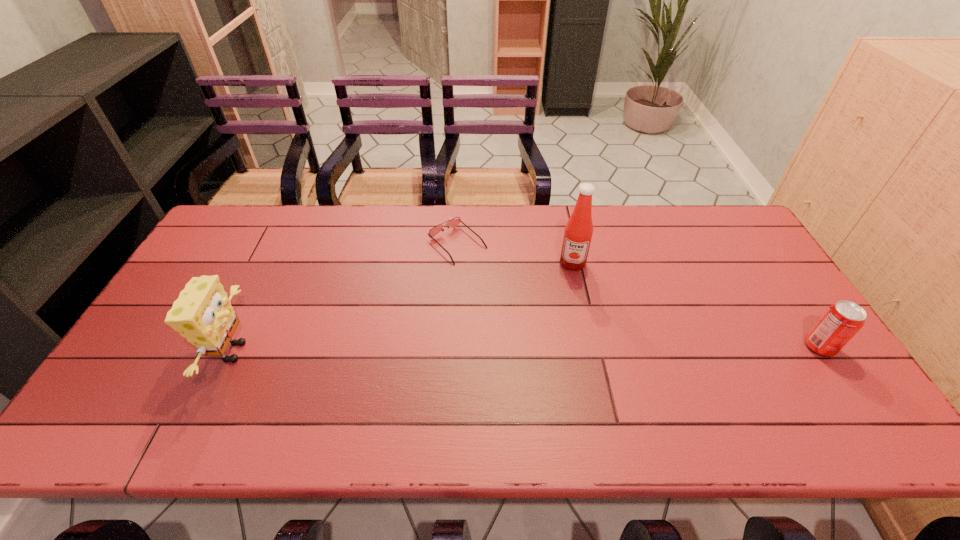
You are a GUI agent. You are given a task and a screenshot of the screen. Output one action in this format:
    pyautogui.click(x=<x>, y=<y>)
    Task: Click on the free location at the right edge
    
    Given the screenshot: What is the action you would take?
    pyautogui.click(x=735, y=260)

In the image, there is a desktop. Where is `vacant space at the far left corner`? vacant space at the far left corner is located at coordinates (232, 240).

Locate an element on the screen. Image resolution: width=960 pixels, height=540 pixels. free point at the far right corner is located at coordinates click(686, 217).

In the image, there is a desktop. Identify the location of vacant space at the near right corner. The image size is (960, 540). (794, 375).

Where is `empty space that is in between the sponge and the third tallest object`? The width and height of the screenshot is (960, 540). empty space that is in between the sponge and the third tallest object is located at coordinates (526, 349).

Image resolution: width=960 pixels, height=540 pixels. In order to click on vacant area between the third object from left to right and the leftmost object in this screenshot , I will do `click(403, 308)`.

Where is `vacant space in between the rightmost object and the tallest object`? The width and height of the screenshot is (960, 540). vacant space in between the rightmost object and the tallest object is located at coordinates (696, 305).

Locate an element on the screen. free spot between the rightmost object and the sponge is located at coordinates (526, 349).

Locate an element on the screen. Image resolution: width=960 pixels, height=540 pixels. free space that is in between the shortest object and the third object from left to right is located at coordinates (515, 254).

Where is `free space between the third object from left to right and the leftmost object`? This screenshot has height=540, width=960. free space between the third object from left to right and the leftmost object is located at coordinates (403, 308).